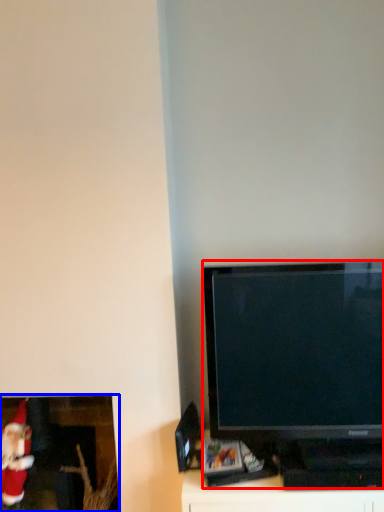
Question: Which point is further to the camera, television (highlighted by a red box) or picture frame (highlighted by a blue box)?

Choices:
 (A) television
 (B) picture frame

Answer: (B)